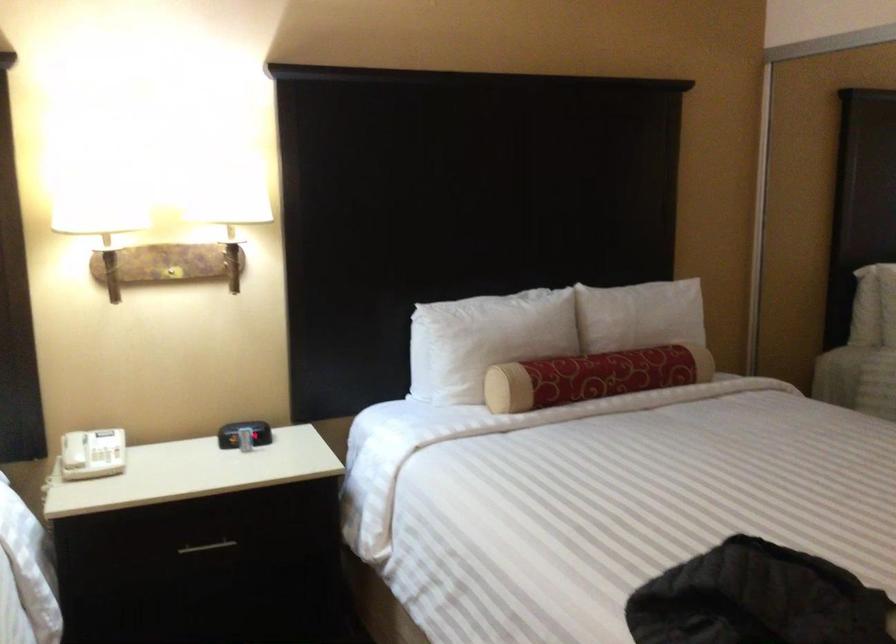
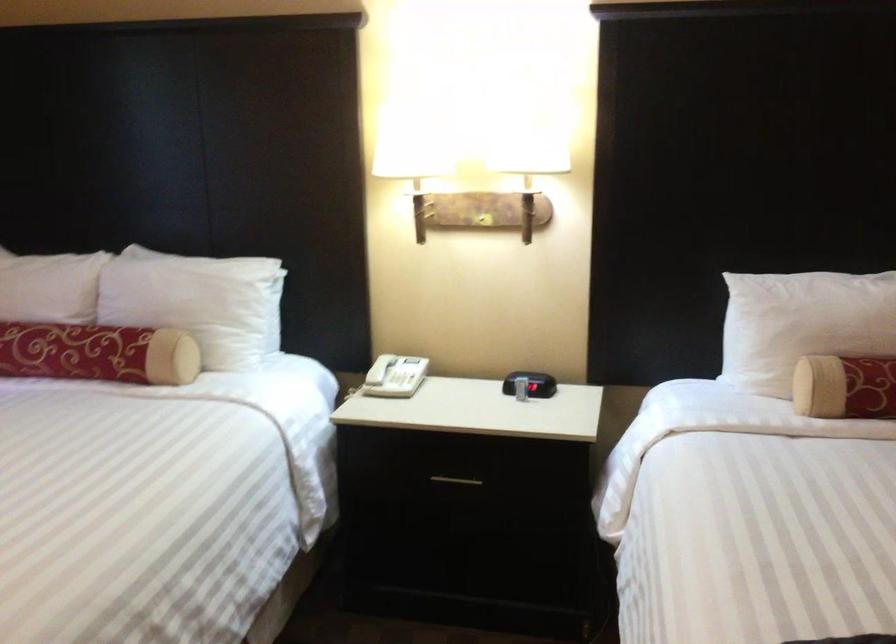
In the second image, find the point that corresponds to point 108,456 in the first image.

(405, 380)